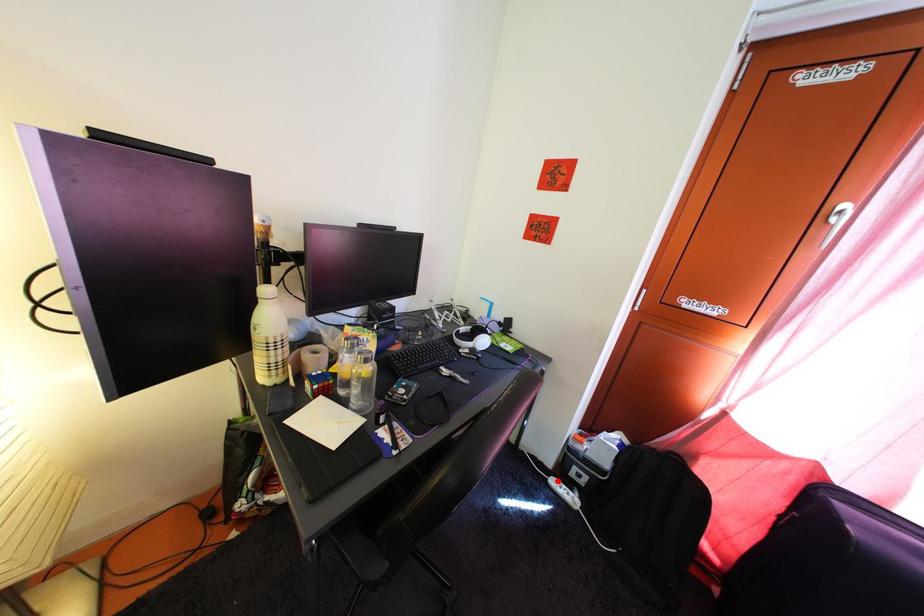
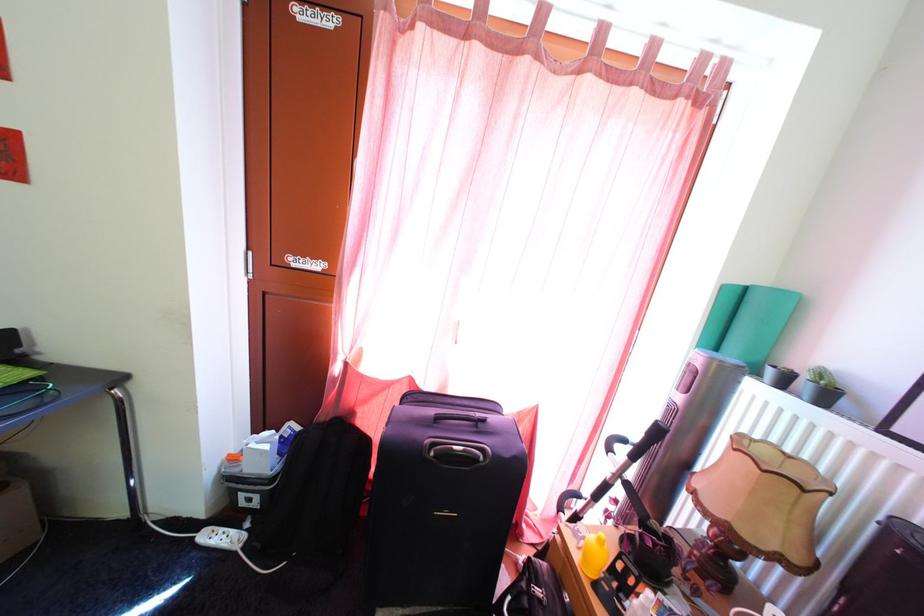
Question: I am providing you with two images of the same scene from different viewpoints. A red point is marked on the first image. Can you still see the location of the red point in image 2?

Choices:
 (A) Yes
 (B) No

Answer: (A)